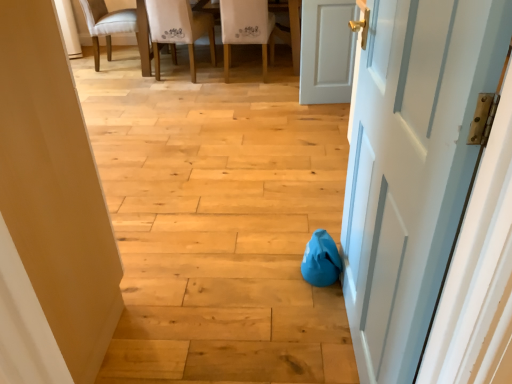
Question: Is white matte door at right, the 3th door from the front, next to light beige fabric chair at upper left, which is the first chair in left-to-right order?

Choices:
 (A) no
 (B) yes

Answer: (A)

Question: Can you confirm if white matte door at right, which is the third door from left to right, is thinner than light beige fabric chair at upper left, placed as the third chair when sorted from right to left?

Choices:
 (A) yes
 (B) no

Answer: (A)

Question: Is white matte door at right, which ranks as the first door in back-to-front order, at the right side of light beige fabric chair at upper left, placed as the third chair when sorted from right to left?

Choices:
 (A) no
 (B) yes

Answer: (B)

Question: Does white matte door at right, which is counted as the first door, starting from the right, have a smaller size compared to light beige fabric chair at upper left, which is the first chair in left-to-right order?

Choices:
 (A) no
 (B) yes

Answer: (B)

Question: Is white matte door at right, the 3th door from the front, positioned far away from light beige fabric chair at upper left, placed as the third chair when sorted from right to left?

Choices:
 (A) yes
 (B) no

Answer: (A)

Question: Is matte white door at center, the 3th door from the right, wider or thinner than white painted wood door at right, which is the first door in front-to-back order?

Choices:
 (A) wide
 (B) thin

Answer: (A)

Question: Which is correct: matte white door at center, placed as the second door when sorted from front to back, is inside white painted wood door at right, arranged as the third door when viewed from the back, or outside of it?

Choices:
 (A) outside
 (B) inside

Answer: (A)

Question: Does point coord(74,132) appear closer or farther from the camera than point coord(417,317)?

Choices:
 (A) farther
 (B) closer

Answer: (A)

Question: From a real-world perspective, is matte white door at center, acting as the first door starting from the left, above or below white painted wood door at right, arranged as the third door when viewed from the back?

Choices:
 (A) above
 (B) below

Answer: (B)

Question: Is matte white door at center, acting as the first door starting from the left, bigger or smaller than white fabric chair at upper center, which ranks as the 3th chair in left-to-right order?

Choices:
 (A) big
 (B) small

Answer: (A)

Question: In the image, is matte white door at center, the 3th door from the right, positioned in front of or behind white fabric chair at upper center, which is counted as the first chair, starting from the right?

Choices:
 (A) front
 (B) behind

Answer: (A)

Question: Is matte white door at center, acting as the first door starting from the left, spatially inside white fabric chair at upper center, which ranks as the 3th chair in left-to-right order, or outside of it?

Choices:
 (A) outside
 (B) inside

Answer: (A)

Question: Considering the positions of matte white door at center, the 2th door in the back-to-front sequence, and white fabric chair at upper center, which is counted as the first chair, starting from the right, in the image, is matte white door at center, the 2th door in the back-to-front sequence, wider or thinner than white fabric chair at upper center, which is counted as the first chair, starting from the right,?

Choices:
 (A) thin
 (B) wide

Answer: (B)

Question: Considering the positions of point (186, 21) and point (129, 28), is point (186, 21) closer or farther from the camera than point (129, 28)?

Choices:
 (A) farther
 (B) closer

Answer: (B)

Question: From the image's perspective, relative to light beige fabric chair at upper left, placed as the third chair when sorted from right to left, is white fabric chair at upper center, marked as the second chair in a right-to-left arrangement, above or below?

Choices:
 (A) above
 (B) below

Answer: (B)